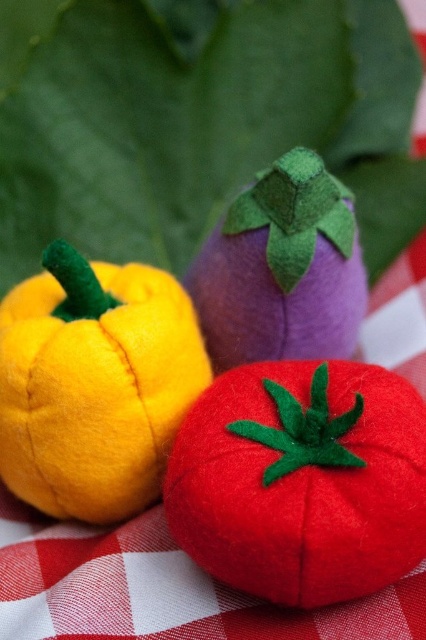
Question: Does matte felt tomato at center have a lesser width compared to purple felt eggplant at center?

Choices:
 (A) no
 (B) yes

Answer: (A)

Question: Does matte felt tomato at center have a greater width compared to purple felt eggplant at center?

Choices:
 (A) no
 (B) yes

Answer: (B)

Question: Which object appears closest to the camera in this image?

Choices:
 (A) matte yellow felt pepper at left
 (B) matte felt tomato at center

Answer: (B)

Question: Which object appears closest to the camera in this image?

Choices:
 (A) matte yellow felt pepper at left
 (B) purple felt eggplant at center
 (C) matte felt tomato at center

Answer: (C)

Question: Does matte felt tomato at center appear on the right side of matte yellow felt pepper at left?

Choices:
 (A) no
 (B) yes

Answer: (B)

Question: Which object is positioned closest to the matte felt tomato at center?

Choices:
 (A) purple felt eggplant at center
 (B) matte yellow felt pepper at left

Answer: (B)